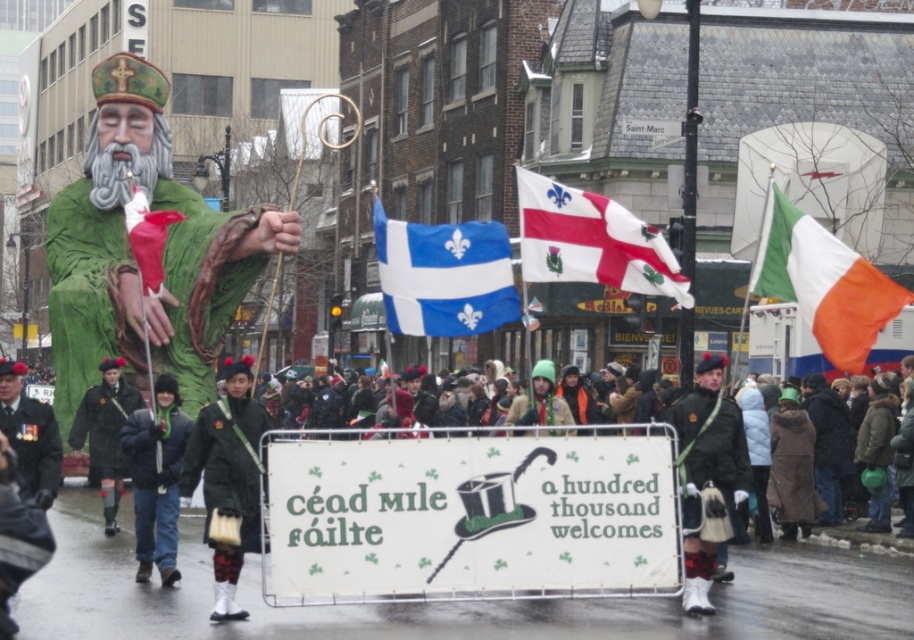
Based on the scene description, where is the white fabric flag at upper right located in the image?

The white fabric flag at upper right is located at point [822,282].

Consider the image. You are a photographer trying to capture the Quebec provincial flag on the float. You notice the white fabric flag at upper right and the dark blue jacket at center. Which object is positioned more to the right side of the float?

The white fabric flag at upper right is positioned more to the right side of the float than the dark blue jacket at center.

In the St. Patrick parade scene, you see a whitematerialflag at center and a dark green uniform at center. Which object is located to the right of the other?

The whitematerialflag at center is positioned on the right side of dark green uniform at center.